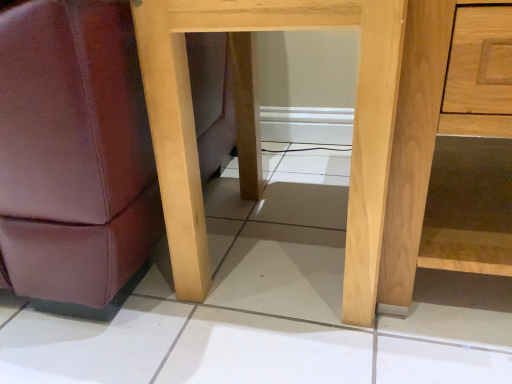
The height and width of the screenshot is (384, 512). What are the coordinates of `natural wood table at center` in the screenshot? It's located at (353, 130).

This screenshot has height=384, width=512. What do you see at coordinates (353, 130) in the screenshot?
I see `natural wood table at center` at bounding box center [353, 130].

What is the approximate width of natural wood table at center?

It is 18.72 inches.

Where is `light brown wood dresser at right`? Image resolution: width=512 pixels, height=384 pixels. light brown wood dresser at right is located at coordinates (414, 144).

What do you see at coordinates (414, 144) in the screenshot?
I see `light brown wood dresser at right` at bounding box center [414, 144].

You are a GUI agent. You are given a task and a screenshot of the screen. Output one action in this format:
    pyautogui.click(x=<x>, y=<y>)
    Task: Click on the natural wood table at center
    This screenshot has height=384, width=512.
    Given the screenshot: What is the action you would take?
    pyautogui.click(x=353, y=130)

Can you confirm if light brown wood dresser at right is positioned to the right of natural wood table at center?

Correct, you'll find light brown wood dresser at right to the right of natural wood table at center.

Considering their positions, is light brown wood dresser at right located in front of or behind natural wood table at center?

Visually, light brown wood dresser at right is located in front of natural wood table at center.

Does point (428, 143) come farther from viewer compared to point (158, 27)?

Yes, it is behind point (158, 27).

From the image's perspective, would you say light brown wood dresser at right is shown under natural wood table at center?

No.

From a real-world perspective, is light brown wood dresser at right under natural wood table at center?

Yes, from a real-world perspective, light brown wood dresser at right is below natural wood table at center.

Is light brown wood dresser at right wider than natural wood table at center?

Yes.

Does light brown wood dresser at right have a greater height compared to natural wood table at center?

In fact, light brown wood dresser at right may be shorter than natural wood table at center.

Is light brown wood dresser at right bigger or smaller than natural wood table at center?

In the image, light brown wood dresser at right appears to be larger than natural wood table at center.

Is light brown wood dresser at right positioned beyond the bounds of natural wood table at center?

That's correct, light brown wood dresser at right is outside of natural wood table at center.

Are light brown wood dresser at right and natural wood table at center beside each other?

There is a gap between light brown wood dresser at right and natural wood table at center.

Is light brown wood dresser at right facing away from natural wood table at center?

No, light brown wood dresser at right is not facing the opposite direction of natural wood table at center.

How many degrees apart are the facing directions of light brown wood dresser at right and natural wood table at center?

They differ by 1.08 degrees in their facing directions.

How distant is light brown wood dresser at right from natural wood table at center?

light brown wood dresser at right is 10.12 centimeters from natural wood table at center.

Where is `table below the light brown wood dresser at right (from the image's perspective)`? Image resolution: width=512 pixels, height=384 pixels. table below the light brown wood dresser at right (from the image's perspective) is located at coordinates click(353, 130).

Can you confirm if natural wood table at center is positioned to the left of light brown wood dresser at right?

Yes.

Considering the relative positions of natural wood table at center and light brown wood dresser at right in the image provided, is natural wood table at center in front of light brown wood dresser at right?

No, natural wood table at center is further to the viewer.

Which is behind, point (162, 21) or point (429, 23)?

The point (162, 21) is more distant.

From the image's perspective, between natural wood table at center and light brown wood dresser at right, who is located below?

From the image's view, natural wood table at center is below.

From a real-world perspective, between natural wood table at center and light brown wood dresser at right, who is vertically lower?

From a 3D spatial view, light brown wood dresser at right is below.

Considering the relative sizes of natural wood table at center and light brown wood dresser at right in the image provided, is natural wood table at center wider than light brown wood dresser at right?

No, natural wood table at center is not wider than light brown wood dresser at right.

Consider the image. Who is shorter, natural wood table at center or light brown wood dresser at right?

Standing shorter between the two is light brown wood dresser at right.

Considering the sizes of objects natural wood table at center and light brown wood dresser at right in the image provided, who is bigger, natural wood table at center or light brown wood dresser at right?

With larger size is light brown wood dresser at right.

Is natural wood table at center completely or partially outside of light brown wood dresser at right?

natural wood table at center is positioned outside light brown wood dresser at right.

Would you consider natural wood table at center to be distant from light brown wood dresser at right?

No, natural wood table at center is in close proximity to light brown wood dresser at right.

Could you tell me if natural wood table at center is facing light brown wood dresser at right?

No, natural wood table at center is not turned towards light brown wood dresser at right.

Measure the distance between natural wood table at center and light brown wood dresser at right.

The distance of natural wood table at center from light brown wood dresser at right is 3.98 inches.

At what (x,y) coordinates should I click in order to perform the action: click on dresser that appears above the natural wood table at center (from the image's perspective). Please return your answer as a coordinate pair (x, y). The image size is (512, 384). Looking at the image, I should click on (414, 144).

You are a GUI agent. You are given a task and a screenshot of the screen. Output one action in this format:
    pyautogui.click(x=<x>, y=<y>)
    Task: Click on the dresser that is on the right side of natural wood table at center
    This screenshot has height=384, width=512.
    Given the screenshot: What is the action you would take?
    pyautogui.click(x=414, y=144)

At what (x,y) coordinates should I click in order to perform the action: click on table that is on the left side of light brown wood dresser at right. Please return your answer as a coordinate pair (x, y). Looking at the image, I should click on (353, 130).